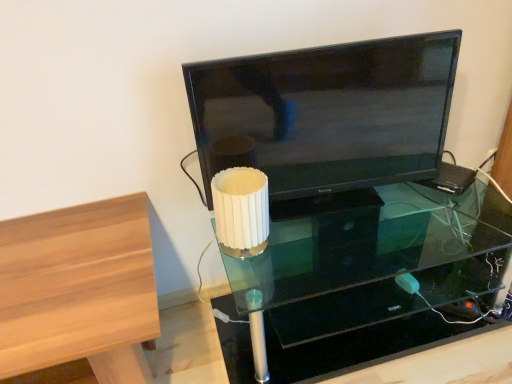
Describe the element at coordinates (355, 290) in the screenshot. I see `transparent glass table at center` at that location.

What do you see at coordinates (241, 211) in the screenshot? This screenshot has height=384, width=512. I see `white ribbed plastic at center` at bounding box center [241, 211].

Image resolution: width=512 pixels, height=384 pixels. In order to click on white ribbed plastic at center in this screenshot , I will do (x=241, y=211).

Locate an element on the screen. light brown wood table at left is located at coordinates (78, 292).

This screenshot has height=384, width=512. Describe the element at coordinates (78, 292) in the screenshot. I see `light brown wood table at left` at that location.

In order to face matte black tv at center, should I rotate leftwards or rightwards?

Rotate your view right by about 9.474°.

Measure the distance between point [292,121] and camera.

Point [292,121] is 1.20 meters away from camera.

Find the location of a particular element. Image resolution: width=512 pixels, height=384 pixels. transparent glass table at center is located at coordinates (355, 290).

Can we say transparent glass table at center lies outside matte black tv at center?

Yes.

Is transparent glass table at center touching matte black tv at center?

No, transparent glass table at center is not making contact with matte black tv at center.

Does transparent glass table at center have a greater height compared to matte black tv at center?

No, transparent glass table at center is not taller than matte black tv at center.

Can you confirm if transparent glass table at center is wider than matte black tv at center?

Correct, the width of transparent glass table at center exceeds that of matte black tv at center.

Can you tell me how much transparent glass table at center and light brown wood table at left differ in facing direction?

The facing directions of transparent glass table at center and light brown wood table at left are 0.31 degrees apart.

Considering the relative positions of transparent glass table at center and light brown wood table at left in the image provided, is transparent glass table at center to the left of light brown wood table at left from the viewer's perspective?

In fact, transparent glass table at center is to the right of light brown wood table at left.

Is transparent glass table at center positioned far away from light brown wood table at left?

No, transparent glass table at center is not far from light brown wood table at left.

Is transparent glass table at center taller than light brown wood table at left?

In fact, transparent glass table at center may be shorter than light brown wood table at left.

Which is more distant, (259, 205) or (225, 133)?

The point (225, 133) is behind.

Looking at this image, which object is closer to the camera, white ribbed plastic at center or matte black tv at center?

matte black tv at center is in front.

Is white ribbed plastic at center wider than matte black tv at center?

Yes, white ribbed plastic at center is wider than matte black tv at center.

From the image's perspective, is white ribbed plastic at center located beneath matte black tv at center?

Correct, white ribbed plastic at center appears lower than matte black tv at center in the image.

In order to click on table directly beneath the matte black tv at center (from a real-world perspective) in this screenshot , I will do click(355, 290).

Can you confirm if matte black tv at center is bigger than transparent glass table at center?

No.

From a real-world perspective, does matte black tv at center stand above transparent glass table at center?

Yes.

Considering the positions of objects matte black tv at center and transparent glass table at center in the image provided, who is more to the left, matte black tv at center or transparent glass table at center?

From the viewer's perspective, matte black tv at center appears more on the left side.

From the image's perspective, is white ribbed plastic at center above or below transparent glass table at center?

white ribbed plastic at center is above transparent glass table at center.

Considering the points (261, 250) and (399, 218), which point is behind, point (261, 250) or point (399, 218)?

Point (399, 218)

Considering the relative sizes of white ribbed plastic at center and transparent glass table at center in the image provided, is white ribbed plastic at center bigger than transparent glass table at center?

No.

Is white ribbed plastic at center far from light brown wood table at left?

That's not correct — white ribbed plastic at center is a little close to light brown wood table at left.

Based on their positions, is white ribbed plastic at center located to the left or right of light brown wood table at left?

Clearly, white ribbed plastic at center is on the right of light brown wood table at left in the image.

From the image's perspective, between white ribbed plastic at center and light brown wood table at left, who is located below?

light brown wood table at left appears lower in the image.

Is transparent glass table at center to the right of white ribbed plastic at center from the viewer's perspective?

Correct, you'll find transparent glass table at center to the right of white ribbed plastic at center.

Looking at the image, does transparent glass table at center seem bigger or smaller compared to white ribbed plastic at center?

transparent glass table at center is bigger than white ribbed plastic at center.

From a real-world perspective, between transparent glass table at center and white ribbed plastic at center, who is vertically higher?

In real-world perspective, white ribbed plastic at center is above.

Can we say transparent glass table at center lies outside white ribbed plastic at center?

Yes, transparent glass table at center is outside of white ribbed plastic at center.

Find the location of a particular element. The height and width of the screenshot is (384, 512). television to the left of transparent glass table at center is located at coordinates (327, 113).

At what (x,y) coordinates should I click in order to perform the action: click on furniture that appears below the transparent glass table at center (from the image's perspective). Please return your answer as a coordinate pair (x, y). Looking at the image, I should click on (78, 292).

From the image, which object appears to be farther from light brown wood table at left, matte black tv at center or transparent glass table at center?

transparent glass table at center is further to light brown wood table at left.

Based on their spatial positions, is white ribbed plastic at center or matte black tv at center closer to transparent glass table at center?

matte black tv at center is closer to transparent glass table at center.

From the image, which object appears to be nearer to white ribbed plastic at center, transparent glass table at center or light brown wood table at left?

light brown wood table at left is positioned closer to the anchor white ribbed plastic at center.

Based on their spatial positions, is matte black tv at center or light brown wood table at left further from transparent glass table at center?

light brown wood table at left.

Considering their positions, is light brown wood table at left positioned closer to transparent glass table at center than matte black tv at center?

matte black tv at center is closer to transparent glass table at center.

When comparing their distances from transparent glass table at center, does matte black tv at center or white ribbed plastic at center seem closer?

The object closer to transparent glass table at center is matte black tv at center.

Considering their positions, is light brown wood table at left positioned further to matte black tv at center than white ribbed plastic at center?

Based on the image, light brown wood table at left appears to be further to matte black tv at center.

From the image, which object appears to be farther from white ribbed plastic at center, matte black tv at center or transparent glass table at center?

Among the two, transparent glass table at center is located further to white ribbed plastic at center.

Locate an element on the screen. This screenshot has width=512, height=384. table lamp that lies between matte black tv at center and transparent glass table at center from top to bottom is located at coordinates (241, 211).

The height and width of the screenshot is (384, 512). In order to click on television situated between light brown wood table at left and transparent glass table at center from left to right in this screenshot , I will do `click(327, 113)`.

Locate an element on the screen. table lamp located between light brown wood table at left and matte black tv at center in the left-right direction is located at coordinates (241, 211).

The width and height of the screenshot is (512, 384). Find the location of `table lamp between light brown wood table at left and transparent glass table at center`. table lamp between light brown wood table at left and transparent glass table at center is located at coordinates (241, 211).